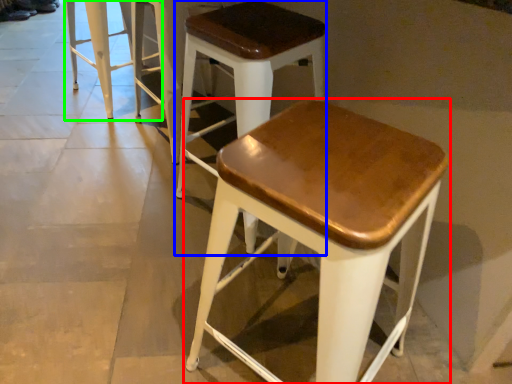
Question: Which object is positioned farthest from stool (highlighted by a red box)? Select from stool (highlighted by a blue box) and stool (highlighted by a green box).

Choices:
 (A) stool
 (B) stool

Answer: (B)